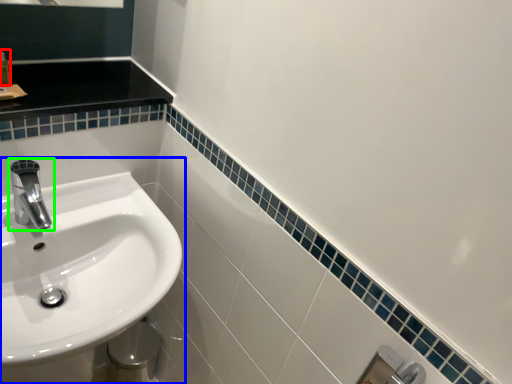
Question: Which object is positioned closest to toiletry (highlighted by a red box)? Select from sink (highlighted by a blue box) and tap (highlighted by a green box).

Choices:
 (A) sink
 (B) tap

Answer: (B)